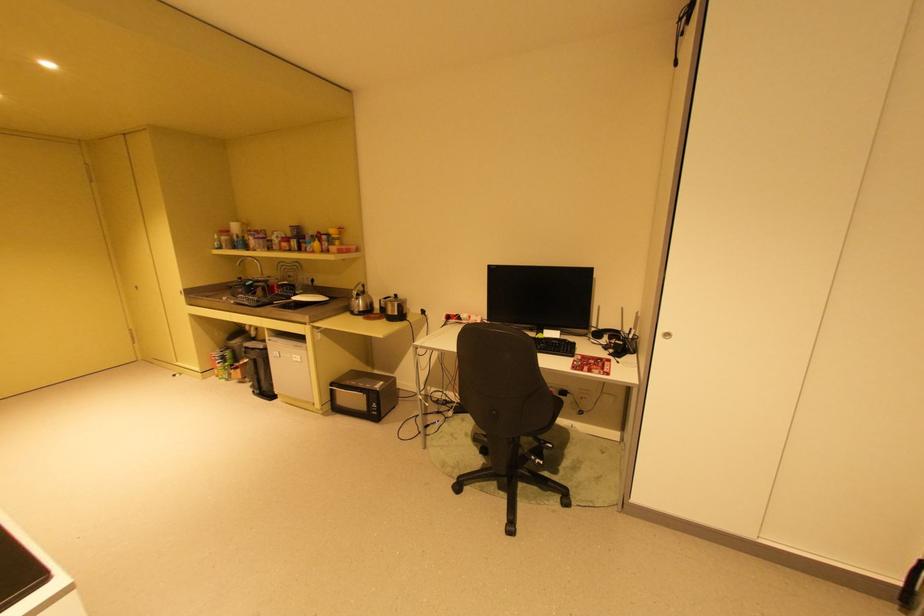
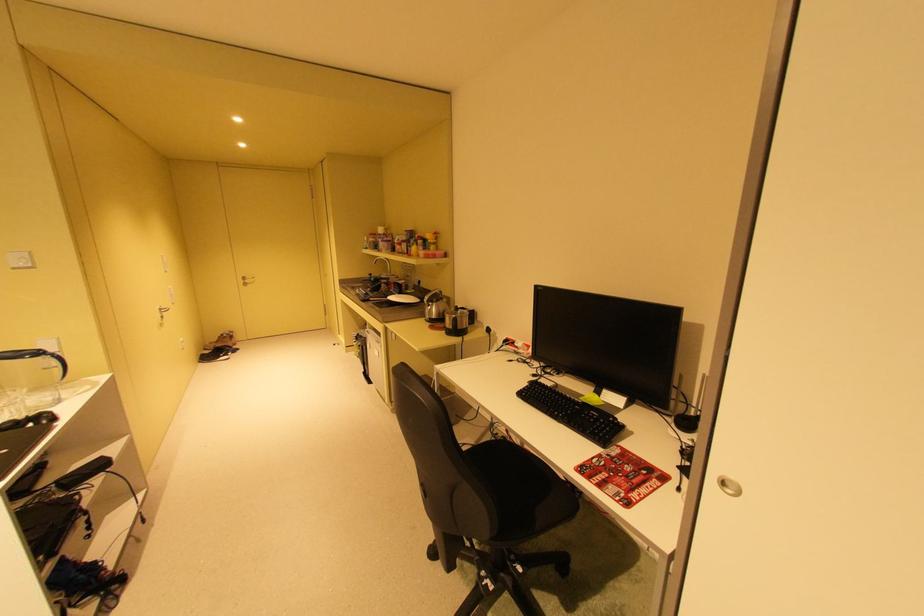
Where in the second image is the point corresponding to point 366,294 from the first image?

(439, 302)